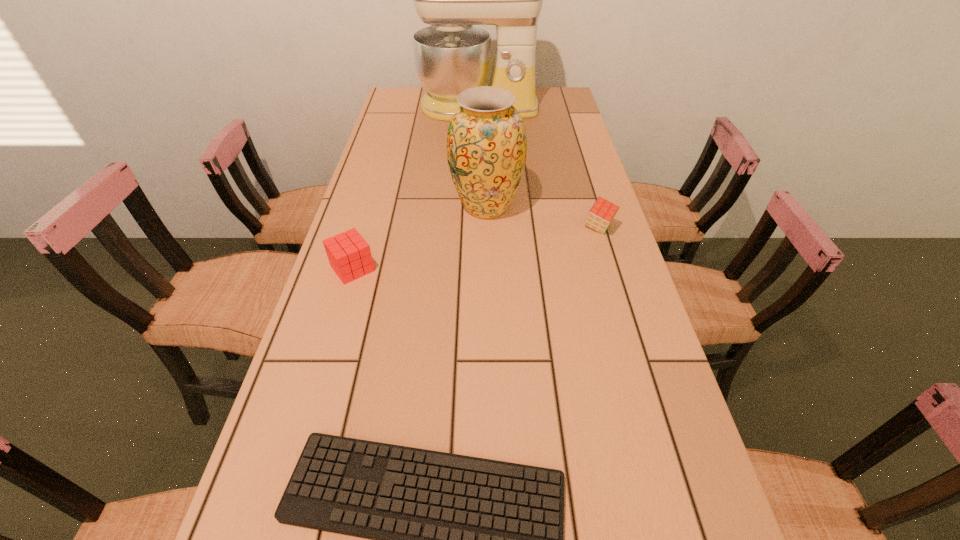
I want to click on vacant area located on the right of the nearer cube, so click(x=452, y=268).

Find the location of a particular element. The image size is (960, 540). object positioned at the far edge is located at coordinates (451, 55).

Where is `mixer present at the left edge`? mixer present at the left edge is located at coordinates (451, 55).

In order to click on cube that is positioned at the left edge in this screenshot , I will do `click(349, 255)`.

Find the location of a particular element. This screenshot has height=540, width=960. mixer at the right edge is located at coordinates (451, 55).

Where is `cube at the right edge`? The image size is (960, 540). cube at the right edge is located at coordinates (601, 214).

Identify the location of object that is at the far left corner. (451, 55).

Find the location of a particular element. This screenshot has height=540, width=960. object located at the far right corner is located at coordinates (451, 55).

In the image, there is a desktop. At what (x,y) coordinates should I click in order to perform the action: click on vacant space at the left edge. Please return your answer as a coordinate pair (x, y). Looking at the image, I should click on (408, 210).

This screenshot has height=540, width=960. What are the coordinates of `blank area at the right edge` in the screenshot? It's located at (595, 353).